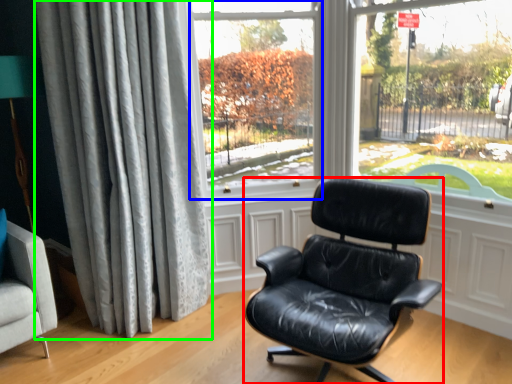
Question: Which is nearer to the chair (highlighted by a red box)? window screen (highlighted by a blue box) or curtain (highlighted by a green box).

Choices:
 (A) window screen
 (B) curtain

Answer: (B)